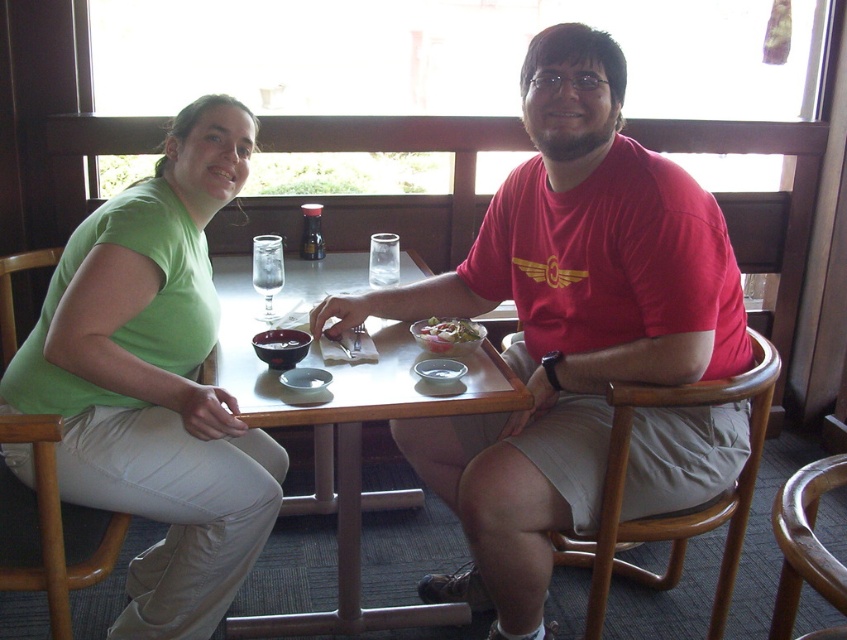
Question: Which point is closer to the camera?

Choices:
 (A) wooden tray at center
 (B) red matte shirt at center
 (C) green cotton shirt at left
 (D) white creamy bowl at center

Answer: (C)

Question: In this image, where is wooden tray at center located relative to white creamy bowl at center?

Choices:
 (A) below
 (B) above

Answer: (B)

Question: Which point is farther to the camera?

Choices:
 (A) (148, 557)
 (B) (421, 346)
 (C) (307, 264)

Answer: (C)

Question: Among these points, which one is farthest from the camera?

Choices:
 (A) (197, 113)
 (B) (446, 349)
 (C) (314, 442)
 (D) (671, 253)

Answer: (C)

Question: Does green cotton shirt at left have a greater width compared to wooden tray at center?

Choices:
 (A) yes
 (B) no

Answer: (B)

Question: Can you confirm if red matte shirt at center is wider than wooden tray at center?

Choices:
 (A) no
 (B) yes

Answer: (B)